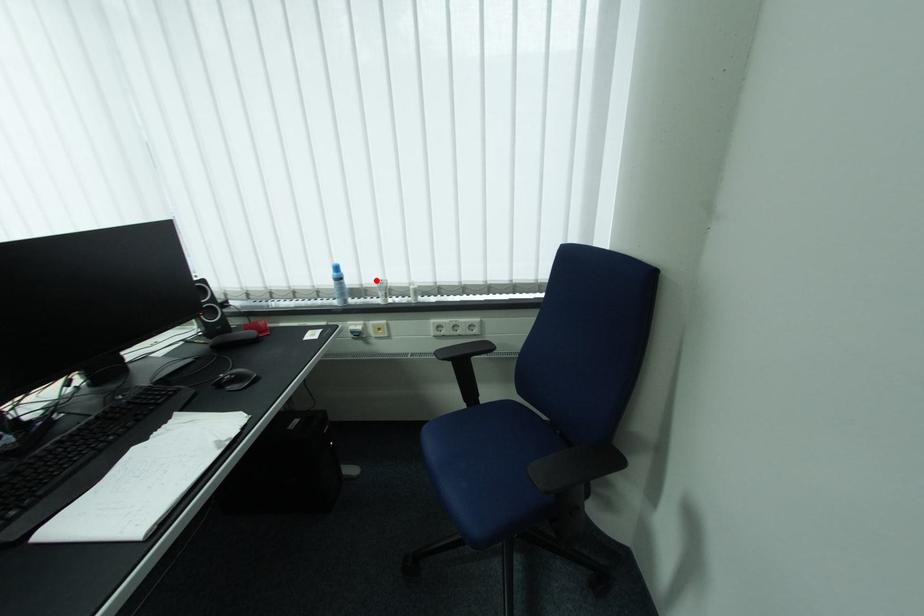
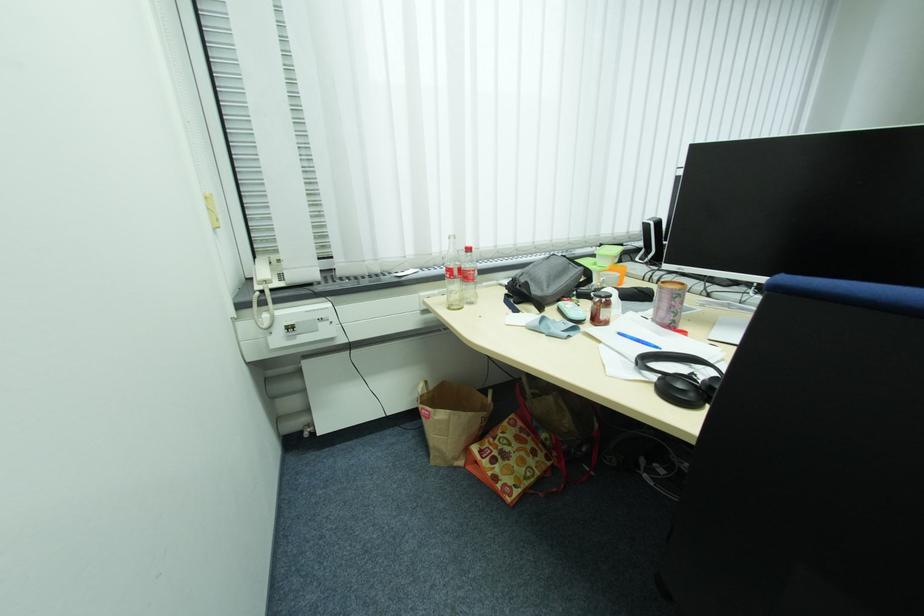
Question: I am providing you with two images of the same scene from different viewpoints. A red point is marked on the first image. Can you still see the location of the red point in image 2?

Choices:
 (A) Yes
 (B) No

Answer: (B)